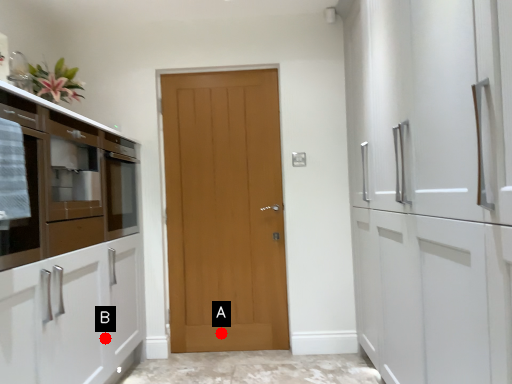
Question: Two points are circled on the image, labeled by A and B beside each circle. Which of the following is the closest to the observer?

Choices:
 (A) A is closer
 (B) B is closer

Answer: (B)